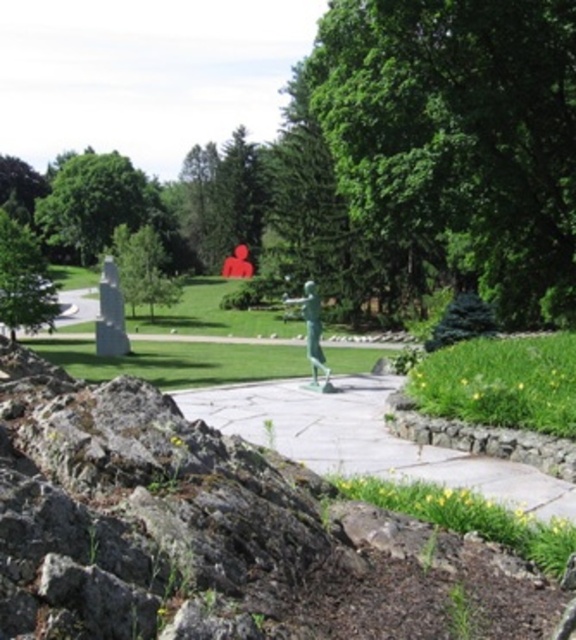
Question: Is green leafy tree at upper left above green leafy tree at left?

Choices:
 (A) no
 (B) yes

Answer: (B)

Question: Does smooth stone path at center appear under green patinated bronze statue at center?

Choices:
 (A) yes
 (B) no

Answer: (A)

Question: Does smooth stone path at center come in front of green leafy tree at left?

Choices:
 (A) yes
 (B) no

Answer: (A)

Question: Which point is closer to the camera?

Choices:
 (A) green patinated bronze statue at center
 (B) smooth stone path at center
 (C) green leafy tree at upper left

Answer: (B)

Question: Which point is closer to the camera?

Choices:
 (A) [x=297, y=456]
 (B) [x=9, y=230]
 (C) [x=128, y=225]
 (D) [x=320, y=332]

Answer: (A)

Question: Which is farther from the smooth stone path at center?

Choices:
 (A) green patinated bronze statue at center
 (B) green leafy tree at center
 (C) green leafy tree at left

Answer: (C)